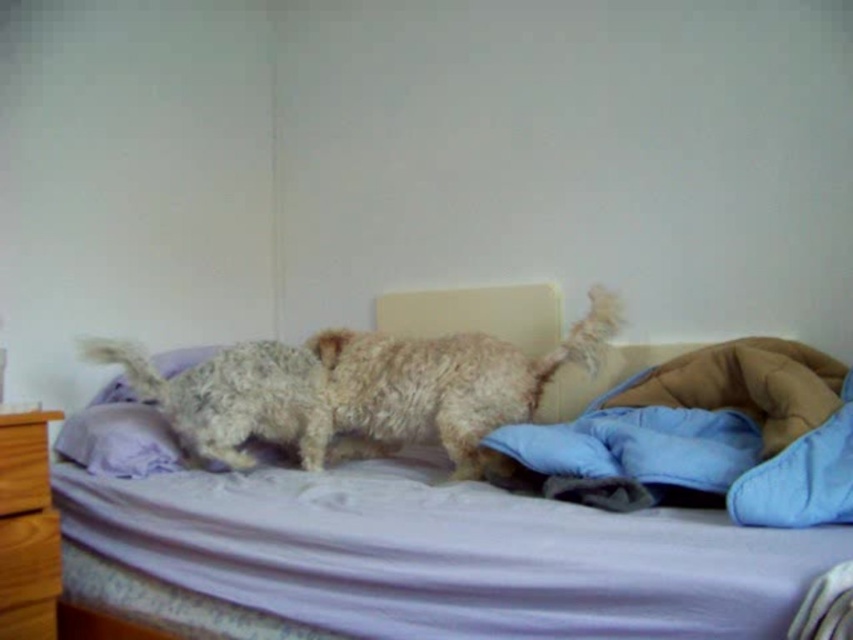
What do you see at coordinates (445, 554) in the screenshot? I see `purple fabric bed at center` at bounding box center [445, 554].

The height and width of the screenshot is (640, 853). I want to click on purple fabric bed at center, so click(x=445, y=554).

Does purple fabric bed at center appear under fuzzy beige dog at center?

Yes, purple fabric bed at center is below fuzzy beige dog at center.

Who is positioned more to the left, purple fabric bed at center or fuzzy beige dog at center?

Positioned to the left is fuzzy beige dog at center.

Which is in front, point (281, 492) or point (201, 410)?

Point (281, 492)

Find the location of `purple fabric bed at center`. purple fabric bed at center is located at coordinates (445, 554).

Does point (161, 403) lie in front of point (22, 445)?

That is False.

Does point (206, 420) lie behind point (13, 554)?

That is True.

Where is `fuzzy beige dog at center`? The width and height of the screenshot is (853, 640). fuzzy beige dog at center is located at coordinates (233, 397).